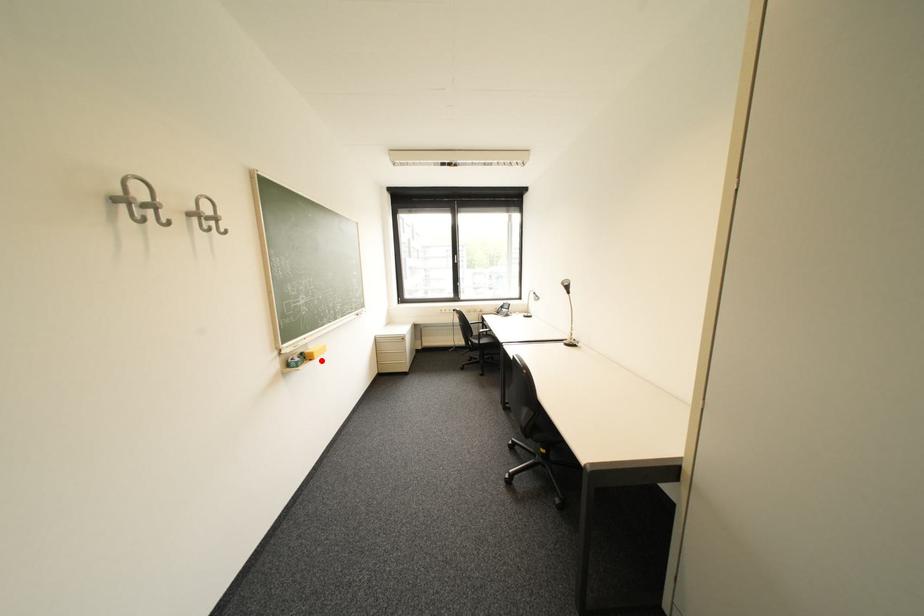
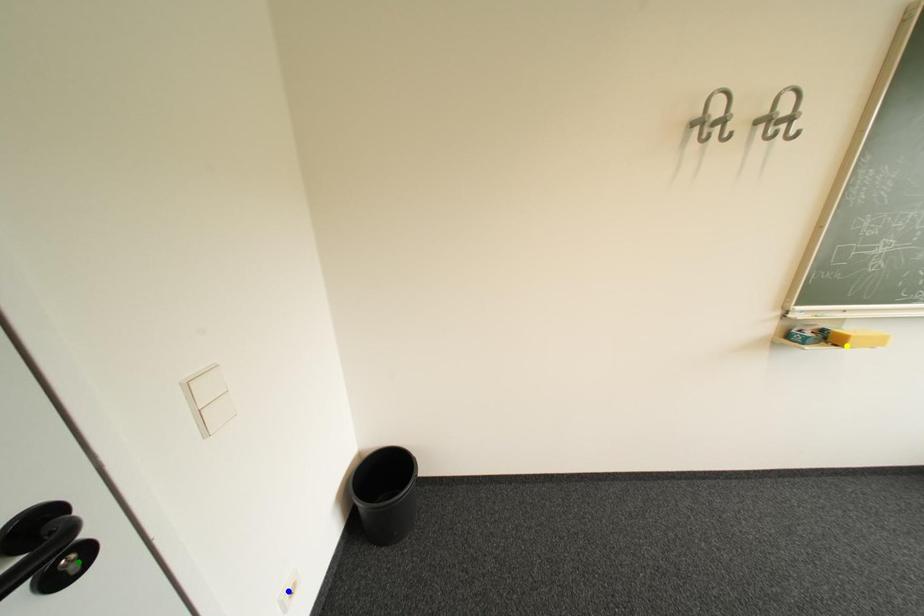
Question: I am providing you with two images of the same scene from different viewpoints. A red point is marked on the first image. You are given multiple points on the second image. In image 2, which mark is for the same physical point as the one in image 1?

Choices:
 (A) green point
 (B) yellow point
 (C) blue point

Answer: (B)